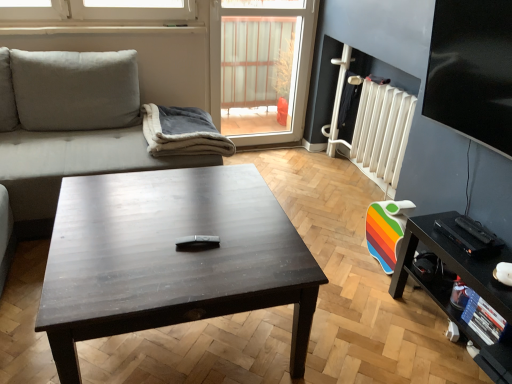
Find the location of `free point above black glossy tv stand at lower right (from a real-world perspective)`. free point above black glossy tv stand at lower right (from a real-world perspective) is located at coordinates (478, 253).